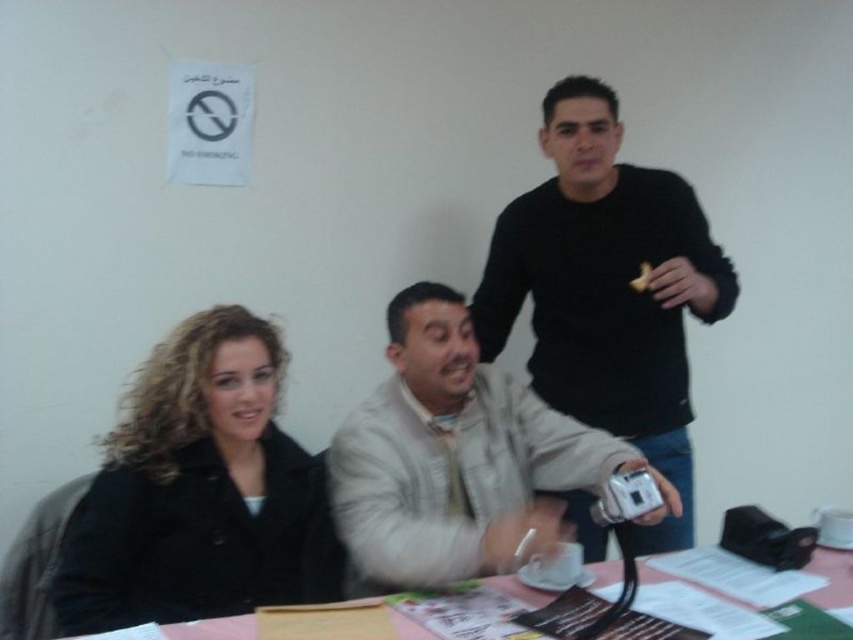
You are a tailor trying to determine if the beige textured jacket at center can fit on the pink plastic table at lower center. Based on the scene, can the jacket fit on the table?

The beige textured jacket at center has a width that is less than the pink plastic table at lower center, so the jacket can fit on the table.

In the scene shown: You are a photographer trying to capture a closeup of the black matte jacket at left without including the pink plastic table at lower center in the frame. Given their distance apart, is this possible?

The black matte jacket at left and pink plastic table at lower center are 61.27 centimeters apart. Since the photographer can adjust the camera angle or zoom to focus solely on the black matte jacket at left while excluding the pink plastic table at lower center, it is possible to achieve this without needing to move either object.

You are a photographer trying to capture a clear shot of the beige textured jacket at center and the pink plastic table at lower center. Since you want the jacket to be the main focus, which object should you position closer to the camera?

The beige textured jacket at center has a greater height compared to the pink plastic table at lower center, so you should position the beige textured jacket at center closer to the camera to emphasize its size and make it the main focus.